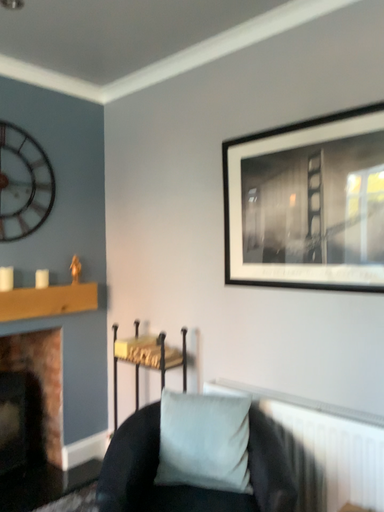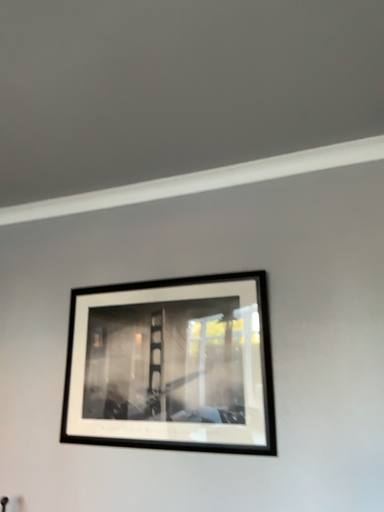
Question: How did the camera likely rotate when shooting the video?

Choices:
 (A) rotated left
 (B) rotated right

Answer: (B)